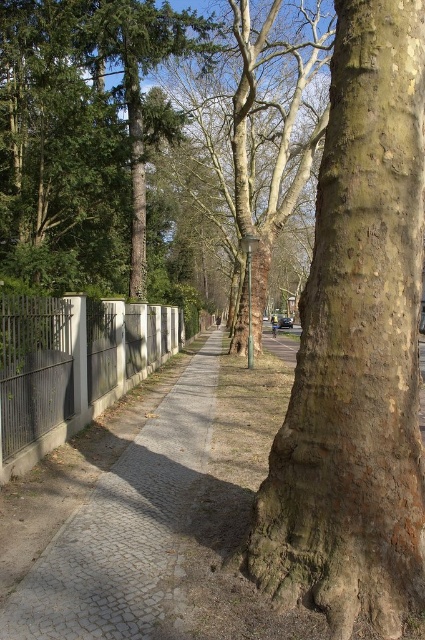
Is point (339, 228) positioned after point (127, 196)?

No, it is not.

Is point (333, 384) closer to camera compared to point (81, 131)?

Yes, it is in front of point (81, 131).

Measure the distance between brown rough bark tree trunk at right and camera.

brown rough bark tree trunk at right and camera are 10.60 feet apart from each other.

In order to click on brown rough bark tree trunk at right in this screenshot , I will do click(357, 348).

Can you confirm if gray cobblestone pavement at center is positioned above white concrete fence at left?

No.

Does point (138, 515) come farther from viewer compared to point (138, 333)?

No, it is in front of (138, 333).

Locate an element on the screen. The height and width of the screenshot is (640, 425). gray cobblestone pavement at center is located at coordinates (122, 525).

Looking at this image, who is positioned more to the right, green matte tree at upper left or gray cobblestone pavement at center?

From the viewer's perspective, gray cobblestone pavement at center appears more on the right side.

Can you confirm if green matte tree at upper left is smaller than gray cobblestone pavement at center?

No.

Locate an element on the screen. Image resolution: width=425 pixels, height=640 pixels. green matte tree at upper left is located at coordinates (82, 134).

Where is `green matte tree at upper left`? green matte tree at upper left is located at coordinates (82, 134).